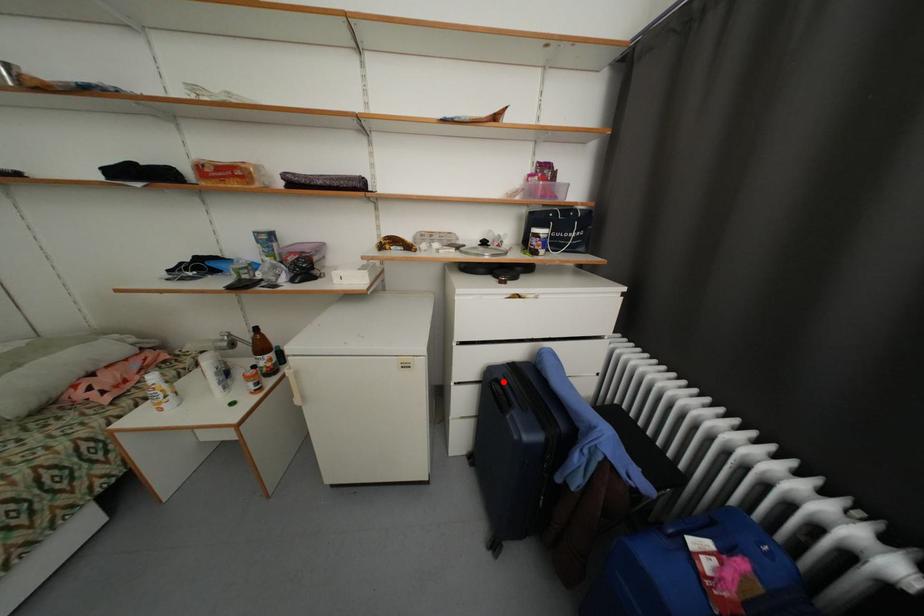
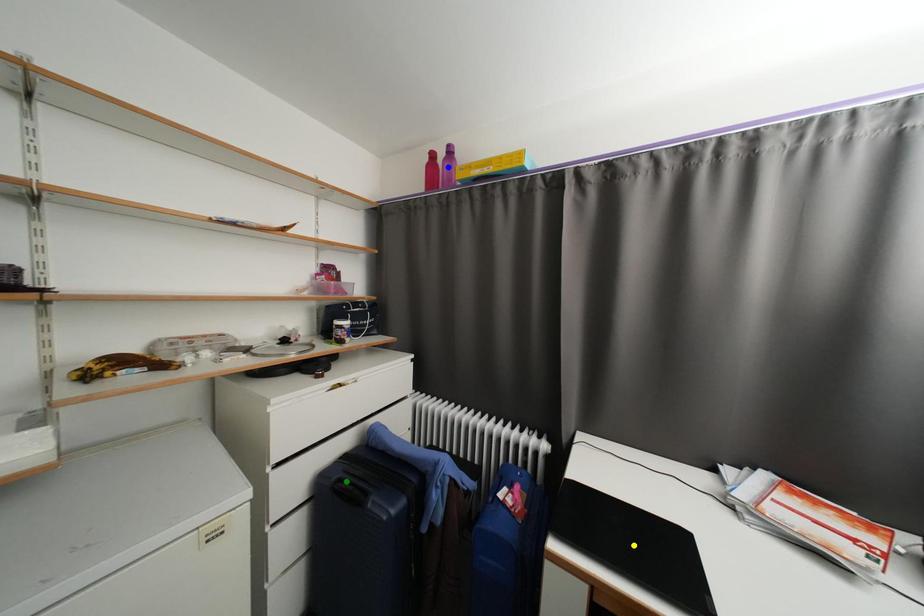
Question: I am providing you with two images of the same scene from different viewpoints. A red point is marked on the first image. You are given multiple points on the second image. Can you choose the point in image 2 that corresponds to the point in image 1?

Choices:
 (A) blue point
 (B) green point
 (C) yellow point

Answer: (B)